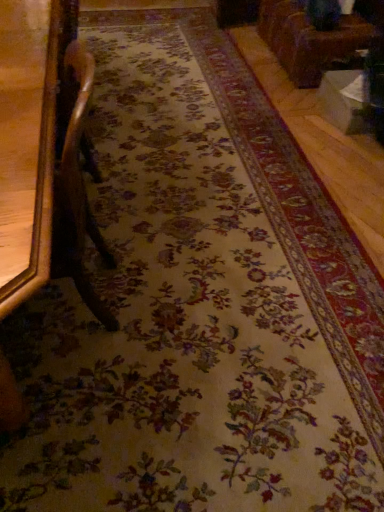
Question: In the image, is brown polished wood chair at left, the 1th furniture when ordered from bottom to top, positioned in front of or behind brown leather couch at upper right, the second furniture when ordered from front to back?

Choices:
 (A) front
 (B) behind

Answer: (A)

Question: From a real-world perspective, is brown polished wood chair at left, which appears as the first furniture when viewed from the front, physically located above or below brown leather couch at upper right, the second furniture from the bottom?

Choices:
 (A) above
 (B) below

Answer: (A)

Question: Considering the relative positions of brown polished wood chair at left, the second furniture from the top, and brown leather couch at upper right, the second furniture from the bottom, in the image provided, is brown polished wood chair at left, the second furniture from the top, to the left or to the right of brown leather couch at upper right, the second furniture from the bottom,?

Choices:
 (A) left
 (B) right

Answer: (A)

Question: Is point (337, 45) closer or farther from the camera than point (44, 80)?

Choices:
 (A) closer
 (B) farther

Answer: (B)

Question: Is brown leather couch at upper right, the second furniture when ordered from front to back, in front of or behind brown polished wood chair at left, which appears as the first furniture when viewed from the front, in the image?

Choices:
 (A) behind
 (B) front

Answer: (A)

Question: Visually, is brown leather couch at upper right, marked as the 2th furniture in a left-to-right arrangement, positioned to the left or to the right of brown polished wood chair at left, the second furniture from the top?

Choices:
 (A) left
 (B) right

Answer: (B)

Question: Is brown leather couch at upper right, the 1th furniture in the back-to-front sequence, situated inside brown polished wood chair at left, which appears as the first furniture when viewed from the front, or outside?

Choices:
 (A) inside
 (B) outside

Answer: (B)